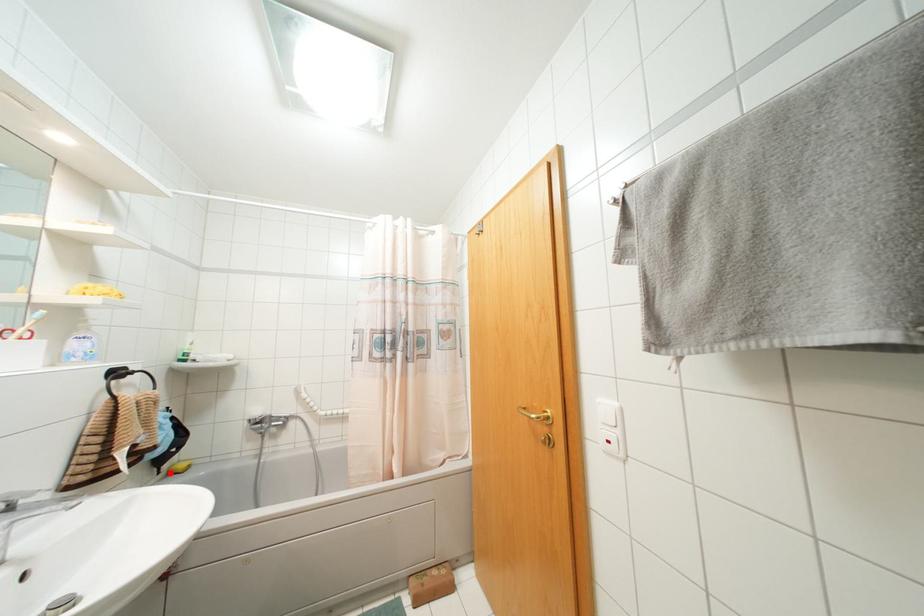
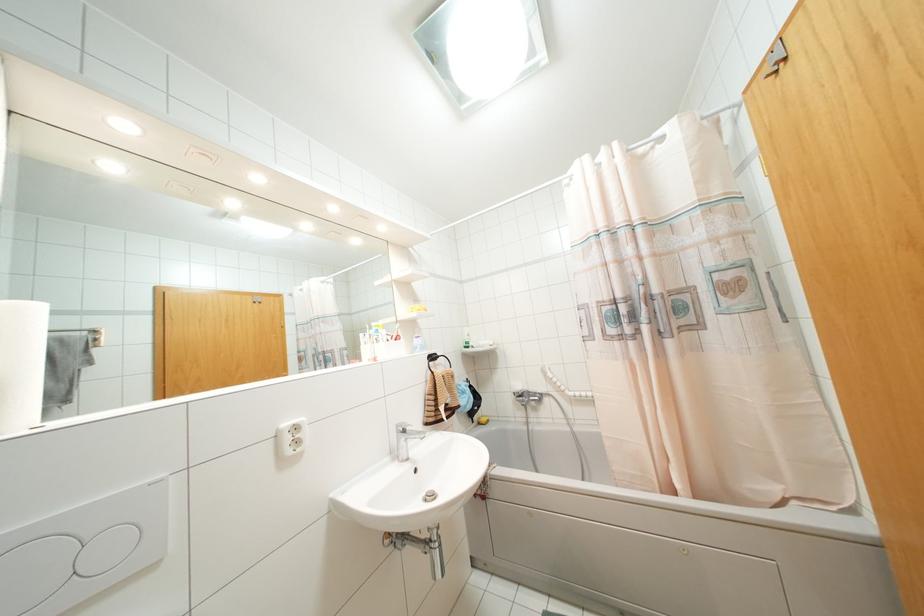
Locate, in the second image, the point that corresponds to the highlighted location in the first image.

(479, 423)